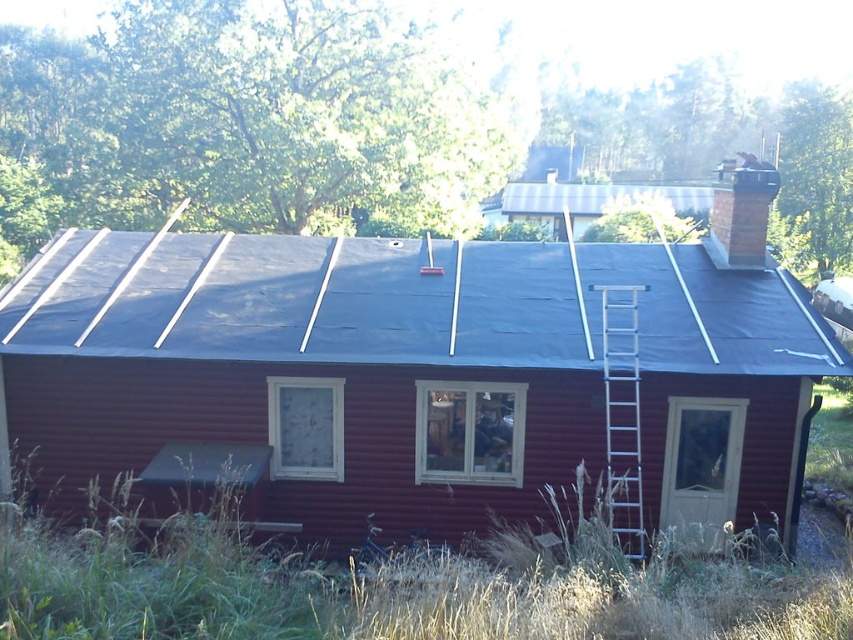
You are a painter standing in front of the house. You need to reach the smooth dark blue tarp at center and the silver metallic ladder at right. Which object is closer to you?

The smooth dark blue tarp at center is closer to you because it is further to the viewer than the silver metallic ladder at right, meaning it appears nearer in the image.

You are a delivery person trying to park your van in front of the house. The van is 2 meters wide. The path to the house is between the black tarp at center and the silver metallic ladder at right. Can the van fit through the path?

The black tarp at center might be wider than silver metallic ladder at right, so the path between them could be wide enough for the van which is 2 meters wide. However, since the exact width isn t specified, there s uncertainty. If the tarp is indeed wider, the path would likely accommodate the van.

You are a contractor assessing the roof of the house. You notice two tarps covering different sections of the roof. Which tarp, the smooth dark blue tarp at center or the black tarp at center, has a greater width?

The smooth dark blue tarp at center has a greater width than the black tarp at center.